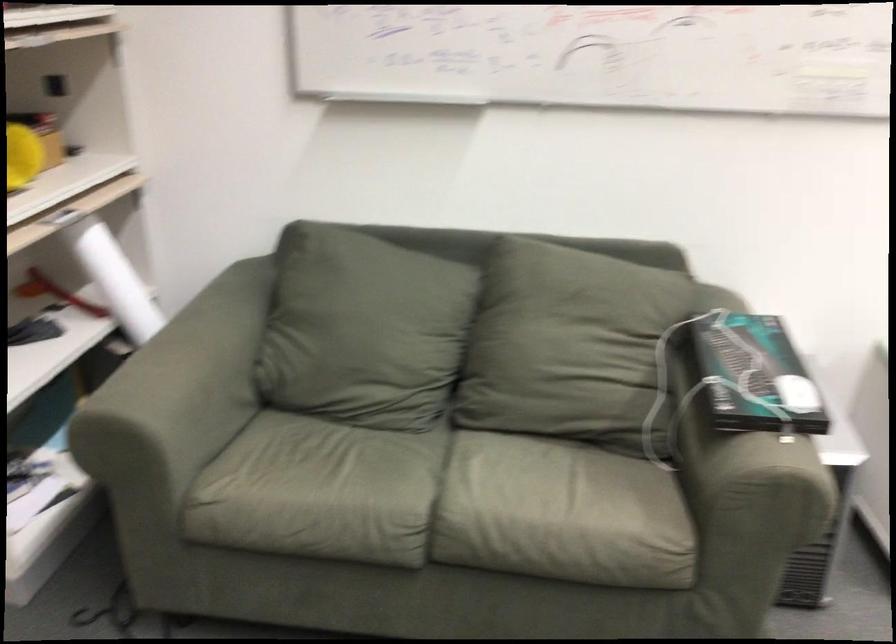
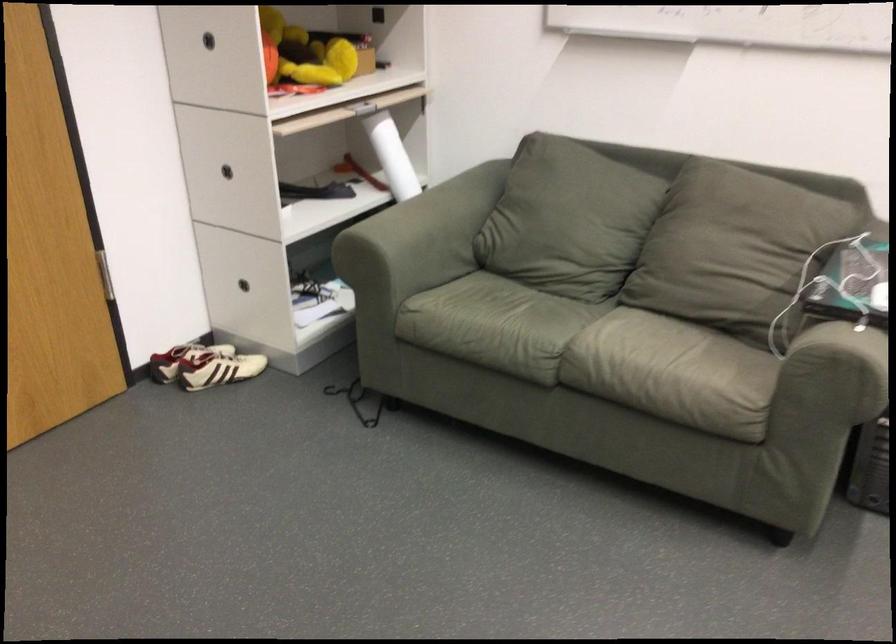
Where in the second image is the point corresponding to point 117,276 from the first image?

(392, 156)